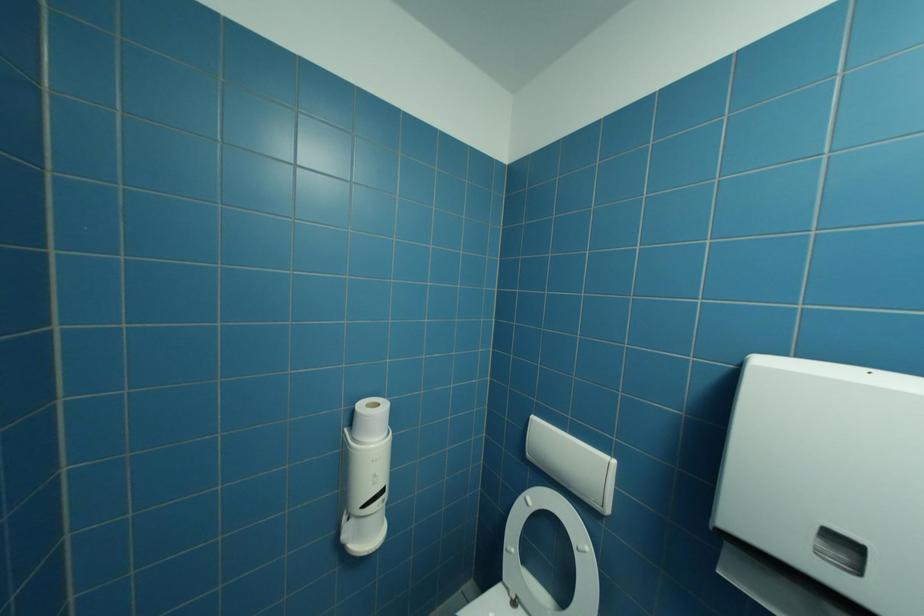
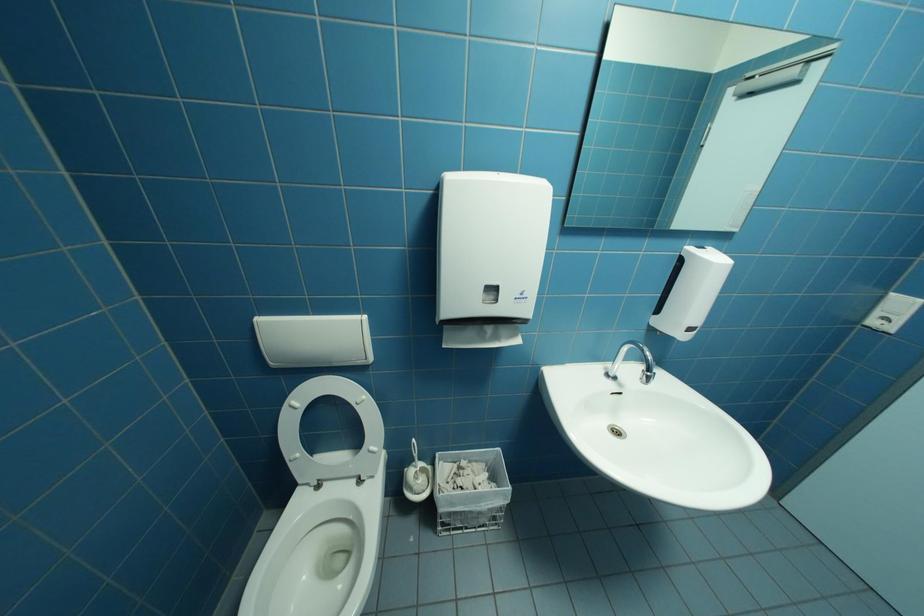
The images are taken continuously from a first-person perspective. In which direction is your viewpoint rotating?

The camera rotated toward right-down.